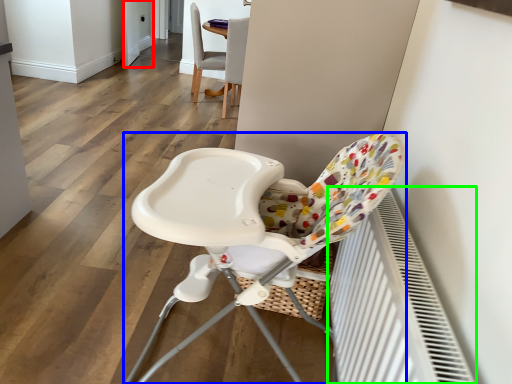
Question: Which object is positioned farthest from screen door (highlighted by a red box)? Select from chair (highlighted by a blue box) and radiator (highlighted by a green box).

Choices:
 (A) chair
 (B) radiator

Answer: (B)